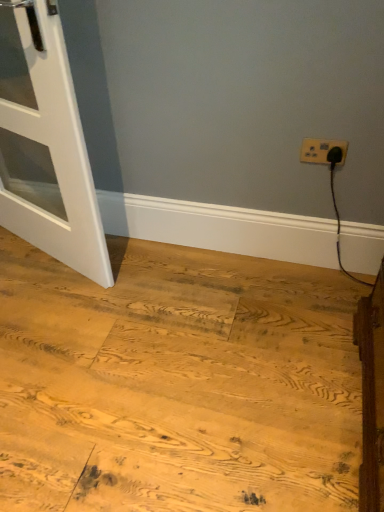
What do you see at coordinates (177, 383) in the screenshot?
I see `natural wood floor at lower left` at bounding box center [177, 383].

What are the coordinates of `white matte door at left` in the screenshot? It's located at (46, 144).

From a real-world perspective, is white plastic power plugs and sockets at upper right above or below white matte door at left?

Clearly, from a real-world perspective, white plastic power plugs and sockets at upper right is below white matte door at left.

Is white plastic power plugs and sockets at upper right to the right of white matte door at left from the viewer's perspective?

Correct, you'll find white plastic power plugs and sockets at upper right to the right of white matte door at left.

How different are the orientations of white plastic power plugs and sockets at upper right and white matte door at left in degrees?

The angle between the facing direction of white plastic power plugs and sockets at upper right and the facing direction of white matte door at left is 22.3 degrees.

Does white matte door at left turn towards white plastic power plugs and sockets at upper right?

No.

Considering the sizes of objects white matte door at left and white plastic power plugs and sockets at upper right in the image provided, who is thinner, white matte door at left or white plastic power plugs and sockets at upper right?

white plastic power plugs and sockets at upper right.

Can you tell me how much white matte door at left and white plastic power plugs and sockets at upper right differ in facing direction?

The facing directions of white matte door at left and white plastic power plugs and sockets at upper right are 22.3 degrees apart.

How distant is white matte door at left from white plastic power plugs and sockets at upper right?

They are 38.39 inches apart.

From the image's perspective, is natural wood floor at lower left on top of white plastic power plugs and sockets at upper right?

No, from the image's perspective, natural wood floor at lower left is not on top of white plastic power plugs and sockets at upper right.

How far apart are natural wood floor at lower left and white plastic power plugs and sockets at upper right?

The distance of natural wood floor at lower left from white plastic power plugs and sockets at upper right is 33.49 inches.

Which object is positioned more to the left, natural wood floor at lower left or white plastic power plugs and sockets at upper right?

natural wood floor at lower left is more to the left.

Locate an element on the screen. Image resolution: width=384 pixels, height=512 pixels. power plugs and sockets positioned vertically above the natural wood floor at lower left (from a real-world perspective) is located at coordinates click(x=321, y=150).

Which is more to the left, white plastic power plugs and sockets at upper right or natural wood floor at lower left?

From the viewer's perspective, natural wood floor at lower left appears more on the left side.

Between white plastic power plugs and sockets at upper right and natural wood floor at lower left, which one has larger size?

natural wood floor at lower left is bigger.

Can you confirm if white plastic power plugs and sockets at upper right is shorter than natural wood floor at lower left?

In fact, white plastic power plugs and sockets at upper right may be taller than natural wood floor at lower left.

From the image's perspective, does white plastic power plugs and sockets at upper right appear lower than natural wood floor at lower left?

No, from the image's perspective, white plastic power plugs and sockets at upper right is not beneath natural wood floor at lower left.

Relative to natural wood floor at lower left, is white matte door at left in front or behind?

white matte door at left is behind natural wood floor at lower left.

From the picture: From the image's perspective, which object appears higher, white matte door at left or natural wood floor at lower left?

white matte door at left is shown above in the image.

Is white matte door at left facing away from natural wood floor at lower left?

white matte door at left does not have its back to natural wood floor at lower left.

From their relative heights in the image, would you say white matte door at left is taller or shorter than natural wood floor at lower left?

white matte door at left is taller than natural wood floor at lower left.

Is natural wood floor at lower left thinner than white matte door at left?

Incorrect, the width of natural wood floor at lower left is not less than that of white matte door at left.

Who is taller, natural wood floor at lower left or white matte door at left?

Standing taller between the two is white matte door at left.

Is white matte door at left located within natural wood floor at lower left?

Definitely not — white matte door at left is not inside natural wood floor at lower left.

The image size is (384, 512). Identify the location of door to the left of white plastic power plugs and sockets at upper right. (46, 144).

The height and width of the screenshot is (512, 384). Find the location of `door that appears in front of the white plastic power plugs and sockets at upper right`. door that appears in front of the white plastic power plugs and sockets at upper right is located at coordinates (46, 144).

From the image, which object appears to be nearer to natural wood floor at lower left, white matte door at left or white plastic power plugs and sockets at upper right?

The object closer to natural wood floor at lower left is white matte door at left.

Looking at the image, which one is located closer to white plastic power plugs and sockets at upper right, natural wood floor at lower left or white matte door at left?

Based on the image, natural wood floor at lower left appears to be nearer to white plastic power plugs and sockets at upper right.

Estimate the real-world distances between objects in this image. Which object is further from white matte door at left, natural wood floor at lower left or white plastic power plugs and sockets at upper right?

Among the two, white plastic power plugs and sockets at upper right is located further to white matte door at left.

Looking at the image, which one is located closer to white matte door at left, white plastic power plugs and sockets at upper right or natural wood floor at lower left?

natural wood floor at lower left lies closer to white matte door at left than the other object.

Looking at this image, estimate the real-world distances between objects in this image. Which object is further from white plastic power plugs and sockets at upper right, white matte door at left or natural wood floor at lower left?

white matte door at left is positioned further to the anchor white plastic power plugs and sockets at upper right.

Looking at the image, which one is located further to natural wood floor at lower left, white plastic power plugs and sockets at upper right or white matte door at left?

Answer: Based on the image, white plastic power plugs and sockets at upper right appears to be further to natural wood floor at lower left.

Identify the location of plywood between white matte door at left and white plastic power plugs and sockets at upper right from left to right. The height and width of the screenshot is (512, 384). (177, 383).